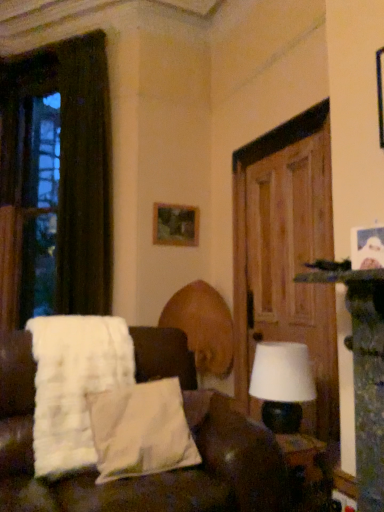
In order to face transparent glass window at left, should I rotate leftwards or rightwards?

Rotate left and turn 19.986 degrees.

Locate an element on the screen. white matte table lamp at right is located at coordinates (282, 384).

The image size is (384, 512). What do you see at coordinates (141, 430) in the screenshot? I see `white soft pillow at lower left` at bounding box center [141, 430].

Describe the element at coordinates (74, 384) in the screenshot. I see `white fluffy blanket at left` at that location.

Locate an element on the screen. Image resolution: width=384 pixels, height=512 pixels. wooden picture frame at upper center is located at coordinates (175, 225).

Image resolution: width=384 pixels, height=512 pixels. Identify the location of wooden door at right. (286, 257).

At what (x,y) coordinates should I click in order to perform the action: click on window on the left of wooden door at right. Please return your answer as a coordinate pair (x, y). The width and height of the screenshot is (384, 512). Looking at the image, I should click on (40, 207).

Between transparent glass window at left and wooden door at right, which one has smaller size?

With smaller size is wooden door at right.

How many degrees apart are the facing directions of transparent glass window at left and wooden door at right?

There is a 35-degree angle between the facing directions of transparent glass window at left and wooden door at right.

The image size is (384, 512). I want to click on door above the white fabric couch at center (from a real-world perspective), so click(286, 257).

Who is smaller, wooden door at right or white fabric couch at center?

wooden door at right.

Considering the relative positions of wooden door at right and white fabric couch at center in the image provided, is wooden door at right to the left of white fabric couch at center from the viewer's perspective?

Incorrect, wooden door at right is not on the left side of white fabric couch at center.

Does wooden door at right have a lesser width compared to white fabric couch at center?

Yes, wooden door at right is thinner than white fabric couch at center.

Is white fabric couch at center positioned with its back to white fluffy blanket at left?

Correct, white fabric couch at center is looking away from white fluffy blanket at left.

Considering the relative positions of white fabric couch at center and white fluffy blanket at left in the image provided, is white fabric couch at center to the left of white fluffy blanket at left from the viewer's perspective?

In fact, white fabric couch at center is to the right of white fluffy blanket at left.

How many degrees apart are the facing directions of white fabric couch at center and white fluffy blanket at left?

They differ by 1.33 degrees in their facing directions.

Would you say white matte table lamp at right is a long distance from transparent glass window at left?

Indeed, white matte table lamp at right is not near transparent glass window at left.

From the image's perspective, does white matte table lamp at right appear lower than transparent glass window at left?

Yes.

Is white matte table lamp at right outside of transparent glass window at left?

Yes, white matte table lamp at right is outside of transparent glass window at left.

Which is more to the left, white matte table lamp at right or transparent glass window at left?

Positioned to the left is transparent glass window at left.

What's the angular difference between white matte table lamp at right and wooden picture frame at upper center's facing directions?

11.6 degrees.

In the scene shown: Measure the distance from white matte table lamp at right to wooden picture frame at upper center.

white matte table lamp at right is 1.72 meters from wooden picture frame at upper center.

From a real-world perspective, which is physically above, white matte table lamp at right or wooden picture frame at upper center?

A: wooden picture frame at upper center.

Is white matte table lamp at right closer to the viewer compared to wooden picture frame at upper center?

That is True.

Would you consider white fluffy blanket at left to be distant from wooden picture frame at upper center?

white fluffy blanket at left is far away from wooden picture frame at upper center.

Is white fluffy blanket at left located outside wooden picture frame at upper center?

Yes, white fluffy blanket at left is located beyond the bounds of wooden picture frame at upper center.

Which point is more forward, (42,403) or (162,205)?

The point (42,403) is in front.

Consider the image. From a real-world perspective, between white fluffy blanket at left and wooden picture frame at upper center, who is vertically lower?

white fluffy blanket at left is physically lower.

Does wooden door at right have a lesser width compared to white soft pillow at lower left?

Correct, the width of wooden door at right is less than that of white soft pillow at lower left.

Is wooden door at right far from white soft pillow at lower left?

Yes, wooden door at right is far from white soft pillow at lower left.

From the image's perspective, is wooden door at right on white soft pillow at lower left?

Correct, wooden door at right appears higher than white soft pillow at lower left in the image.

Based on their positions, is wooden door at right located to the left or right of white soft pillow at lower left?

Based on their positions, wooden door at right is located to the right of white soft pillow at lower left.

The image size is (384, 512). I want to click on window that is on the left side of wooden door at right, so click(x=40, y=207).

This screenshot has height=512, width=384. In the image, there is a white fabric couch at center. Identify the location of door above it (from the image's perspective). (286, 257).

Estimate the real-world distances between objects in this image. Which object is closer to white soft pillow at lower left, white fluffy blanket at left or transparent glass window at left?

white fluffy blanket at left is closer to white soft pillow at lower left.

Estimate the real-world distances between objects in this image. Which object is closer to wooden picture frame at upper center, white fabric couch at center or white soft pillow at lower left?

The object closer to wooden picture frame at upper center is white fabric couch at center.

Based on their spatial positions, is white matte table lamp at right or wooden door at right closer to white fabric couch at center?

white matte table lamp at right.

Which object lies further to the anchor point wooden picture frame at upper center, transparent glass window at left or white soft pillow at lower left?

Based on the image, white soft pillow at lower left appears to be further to wooden picture frame at upper center.

When comparing their distances from wooden door at right, does white soft pillow at lower left or white fabric couch at center seem further?

white soft pillow at lower left is further to wooden door at right.

Based on their spatial positions, is white matte table lamp at right or white fluffy blanket at left closer to dark brown fabric curtain at left?

white fluffy blanket at left.

Looking at this image, when comparing their distances from white fluffy blanket at left, does white matte table lamp at right or white soft pillow at lower left seem closer?

white soft pillow at lower left.

From the image, which object appears to be farther from dark brown fabric curtain at left, transparent glass window at left or wooden picture frame at upper center?

transparent glass window at left.

At what (x,y) coordinates should I click in order to perform the action: click on table lamp between white soft pillow at lower left and dark brown fabric curtain at left in the front-back direction. Please return your answer as a coordinate pair (x, y). The height and width of the screenshot is (512, 384). Looking at the image, I should click on (282, 384).

Locate an element on the screen. The width and height of the screenshot is (384, 512). pillow between white fabric couch at center and wooden picture frame at upper center in the front-back direction is located at coordinates (141, 430).

I want to click on curtain positioned between white fluffy blanket at left and transparent glass window at left from near to far, so click(84, 179).

The height and width of the screenshot is (512, 384). What are the coordinates of `table lamp between white soft pillow at lower left and transparent glass window at left in the front-back direction` in the screenshot? It's located at (282, 384).